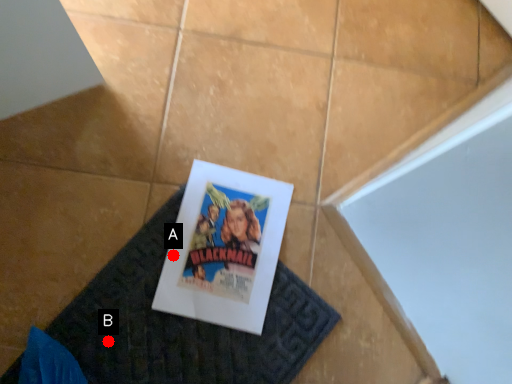
Question: Two points are circled on the image, labeled by A and B beside each circle. Which point is closer to the camera?

Choices:
 (A) A is closer
 (B) B is closer

Answer: (B)